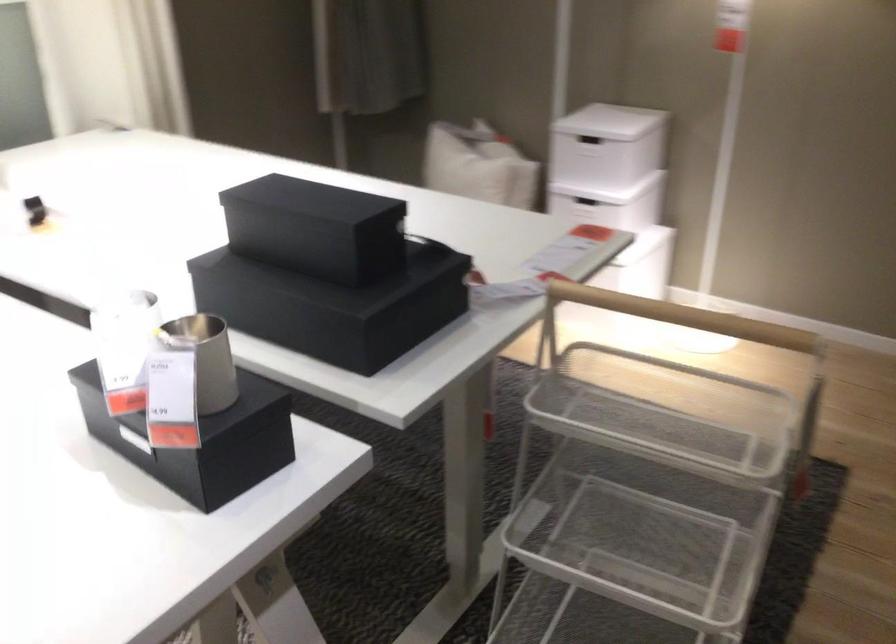
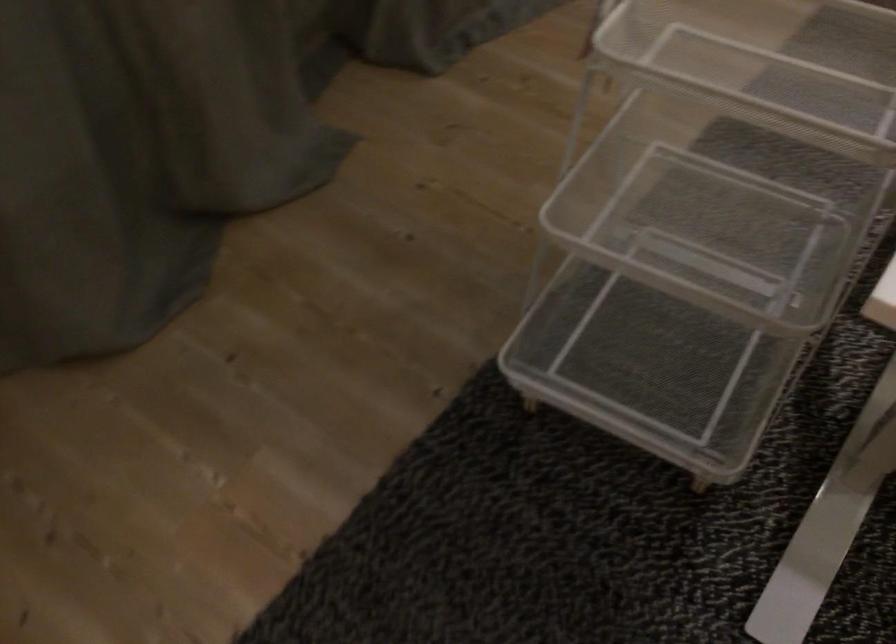
Where in the second image is the point corresponding to pixel 661 558 from the first image?

(698, 209)